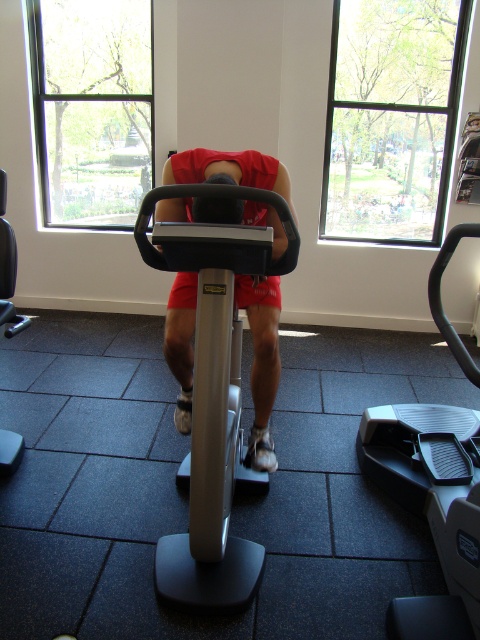
Question: Which point appears farthest from the camera in this image?

Choices:
 (A) (382, 422)
 (B) (265, 346)

Answer: (A)

Question: Can you confirm if gray rubber tread at center is positioned to the left of metallic silver exercise bike at center?

Choices:
 (A) no
 (B) yes

Answer: (A)

Question: Does gray rubber tread at center appear on the right side of metallic silver exercise bike at center?

Choices:
 (A) yes
 (B) no

Answer: (A)

Question: Which object is closer to the camera taking this photo?

Choices:
 (A) metallic silver exercise bike at center
 (B) gray rubber tread at center

Answer: (A)

Question: Does gray rubber tread at center appear over metallic silver exercise bike at center?

Choices:
 (A) yes
 (B) no

Answer: (B)